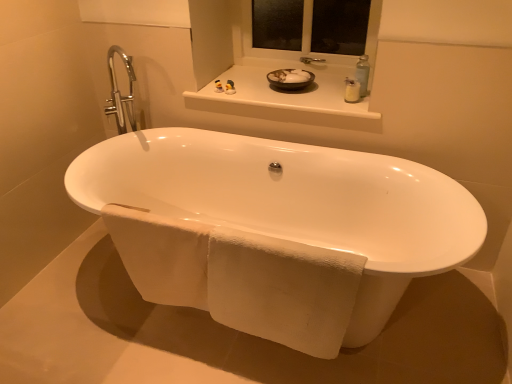
Image resolution: width=512 pixels, height=384 pixels. What are the coordinates of `vacant area that is in front of white glossy bowl at upper center` in the screenshot? It's located at (303, 104).